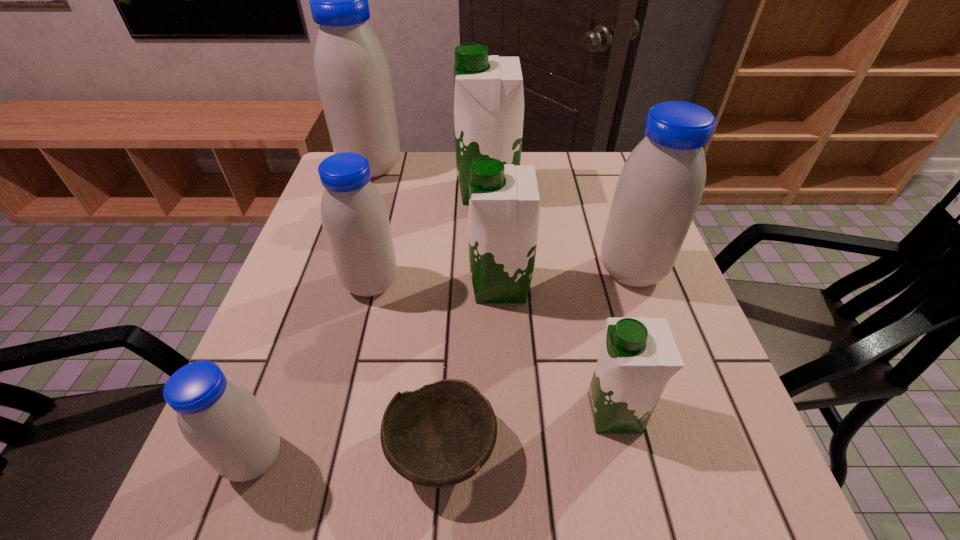
This screenshot has width=960, height=540. What are the coordinates of `free region located 0.080m on the front of the tallest soya milk` in the screenshot? It's located at (360, 201).

The width and height of the screenshot is (960, 540). Identify the location of blank space located 0.050m on the front-facing side of the biggest green soya milk. (440, 192).

Identify the location of free spot located on the front-facing side of the biggest green soya milk. Image resolution: width=960 pixels, height=540 pixels. (440, 192).

Where is `vacant space located 0.130m on the front-facing side of the biggest green soya milk`? The width and height of the screenshot is (960, 540). vacant space located 0.130m on the front-facing side of the biggest green soya milk is located at coordinates (411, 192).

I want to click on blank area located 0.090m on the front of the second biggest blue soya milk, so click(652, 329).

What are the coordinates of `free space located on the front-facing side of the second biggest green soya milk` in the screenshot? It's located at (374, 286).

Locate an element on the screen. Image resolution: width=960 pixels, height=540 pixels. blank space located on the front-facing side of the second biggest green soya milk is located at coordinates (396, 286).

Locate an element on the screen. free spot located on the front-facing side of the second biggest green soya milk is located at coordinates (406, 286).

I want to click on vacant space located 0.100m on the left of the second smallest blue soya milk, so click(298, 283).

The width and height of the screenshot is (960, 540). In order to click on vacant space located 0.390m on the front-facing side of the rightmost green soya milk in this screenshot , I will do (358, 412).